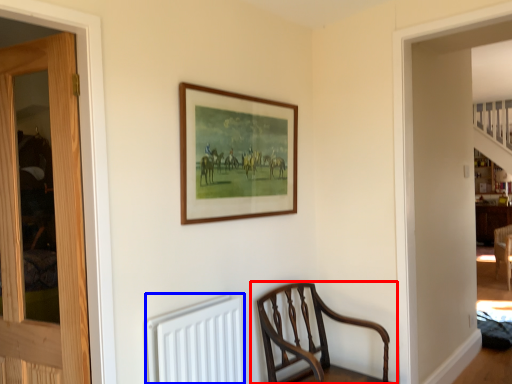
Question: Which of the following is the closest to the observer, chair (highlighted by a red box) or radiator (highlighted by a blue box)?

Choices:
 (A) chair
 (B) radiator

Answer: (B)